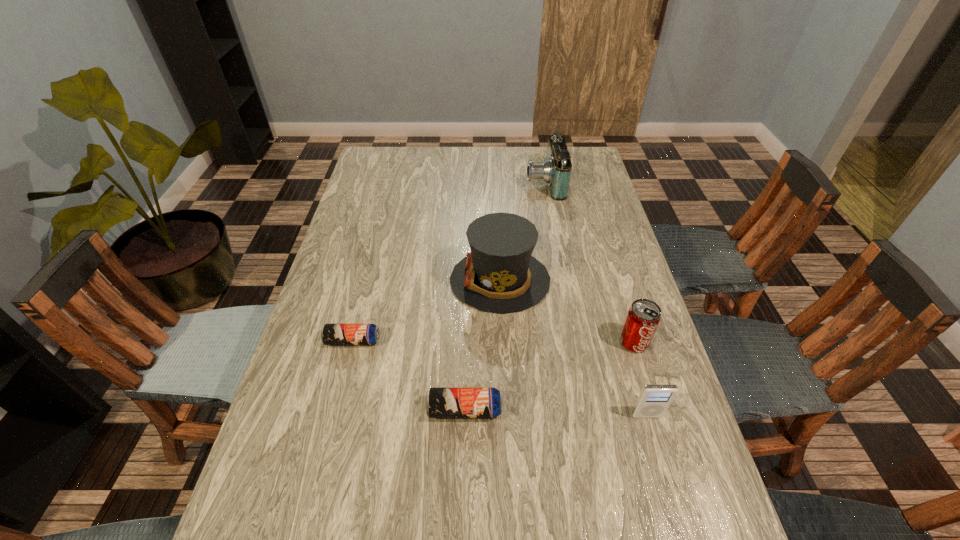
You are a GUI agent. You are given a task and a screenshot of the screen. Output one action in this format:
    pyautogui.click(x=<x>, y=<y>)
    Task: Click on the vacant space situated on the front of the fifth tallest object
    The image size is (960, 540).
    Given the screenshot: What is the action you would take?
    pyautogui.click(x=463, y=489)

Where is `vacant point located 0.080m with goggles on the front of the second farthest object`? The image size is (960, 540). vacant point located 0.080m with goggles on the front of the second farthest object is located at coordinates (422, 280).

At what (x,y) coordinates should I click in order to perform the action: click on free region located with goggles on the front of the second farthest object. Please return your answer as a coordinate pair (x, y). The height and width of the screenshot is (540, 960). Looking at the image, I should click on tap(324, 280).

Image resolution: width=960 pixels, height=540 pixels. Find the location of `free space located 0.160m with goggles on the front of the second farthest object`. free space located 0.160m with goggles on the front of the second farthest object is located at coordinates (396, 280).

This screenshot has width=960, height=540. Identify the location of vacant space located 0.340m on the front of the pop soda. (681, 497).

In order to click on free space located 0.120m on the front-facing side of the camcorder in this screenshot , I will do `click(493, 182)`.

Image resolution: width=960 pixels, height=540 pixels. What are the coordinates of `free space located on the front-facing side of the camcorder` in the screenshot? It's located at click(419, 182).

Locate an element on the screen. The image size is (960, 540). free space located on the front-facing side of the camcorder is located at coordinates (419, 182).

The image size is (960, 540). In order to click on blank area located on the front-facing side of the iPod in this screenshot , I will do `click(666, 483)`.

Locate an element on the screen. The width and height of the screenshot is (960, 540). object that is at the far edge is located at coordinates (555, 170).